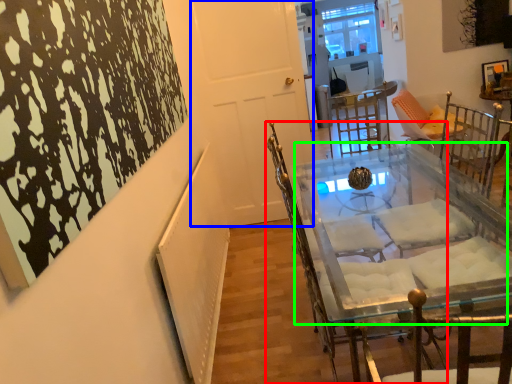
Question: Estimate the real-world distances between objects in this image. Which object is farther from chair (highlighted by a red box), door (highlighted by a blue box) or round table (highlighted by a green box)?

Choices:
 (A) door
 (B) round table

Answer: (A)